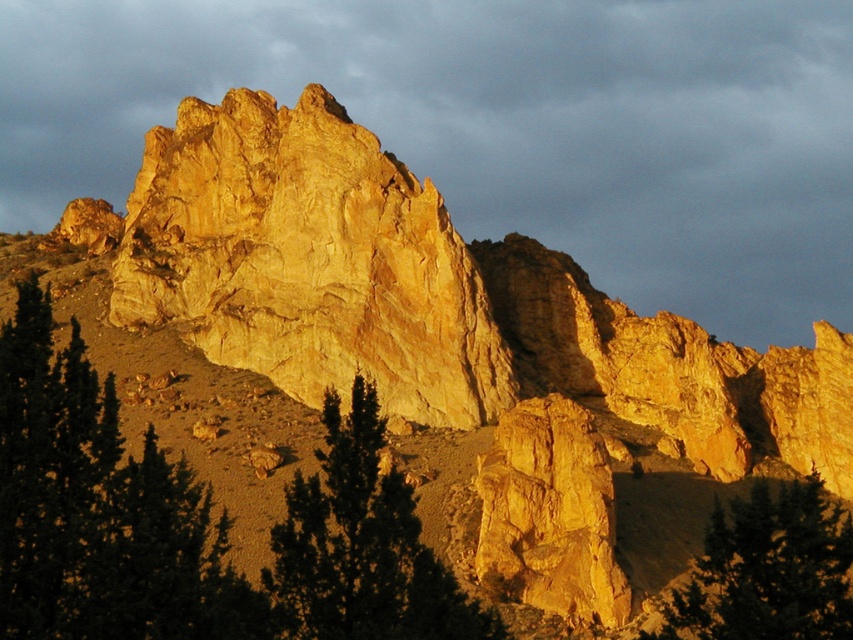
Does yellow rock formation at upper center have a greater width compared to green matte tree at lower right?

Indeed, yellow rock formation at upper center has a greater width compared to green matte tree at lower right.

Is yellow rock formation at upper center bigger than green matte tree at lower right?

Yes.

Which is behind, point (843, 109) or point (790, 522)?

The point (843, 109) is more distant.

Locate an element on the screen. yellow rock formation at upper center is located at coordinates (498, 125).

Is point (828, 136) behind point (154, 173)?

Yes, point (828, 136) is behind point (154, 173).

Does yellow rock formation at upper center have a smaller size compared to yellow sandstone rock at center?

Incorrect, yellow rock formation at upper center is not smaller in size than yellow sandstone rock at center.

Is point (802, 13) closer to camera compared to point (167, 160)?

No.

You are a GUI agent. You are given a task and a screenshot of the screen. Output one action in this format:
    pyautogui.click(x=<x>, y=<y>)
    Task: Click on the yellow rock formation at upper center
    The width and height of the screenshot is (853, 640).
    Given the screenshot: What is the action you would take?
    pyautogui.click(x=498, y=125)

Who is higher up, green matte tree at lower left or green matte tree at lower right?

green matte tree at lower left

From the picture: Is green matte tree at lower left positioned behind green matte tree at lower right?

No, it is in front of green matte tree at lower right.

The image size is (853, 640). In order to click on green matte tree at lower left in this screenshot , I will do `click(99, 509)`.

Where is `green matte tree at lower left`? This screenshot has height=640, width=853. green matte tree at lower left is located at coordinates (99, 509).